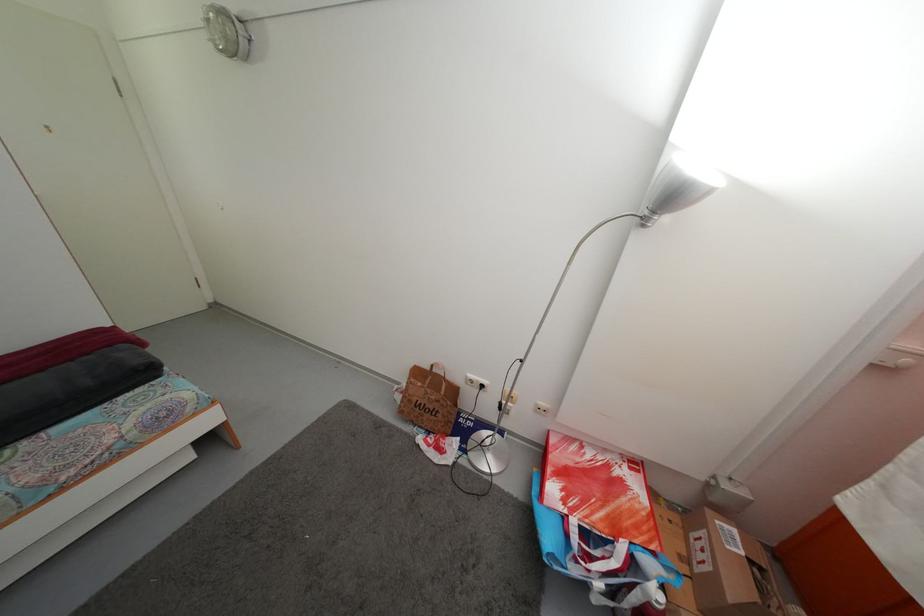
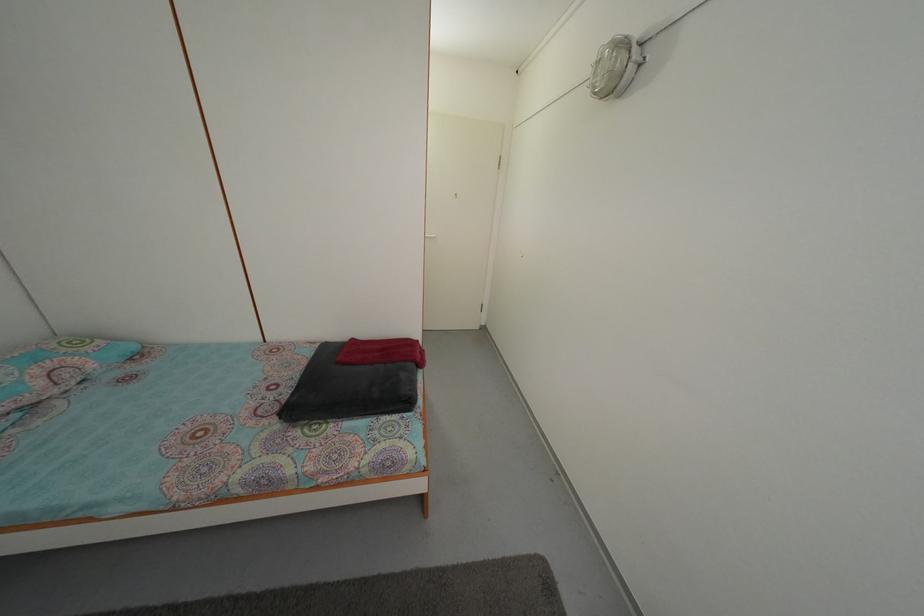
Question: The first image is from the beginning of the video and the second image is from the end. How did the camera likely rotate when shooting the video?

Choices:
 (A) Left
 (B) Right
 (C) Up
 (D) Down

Answer: (A)